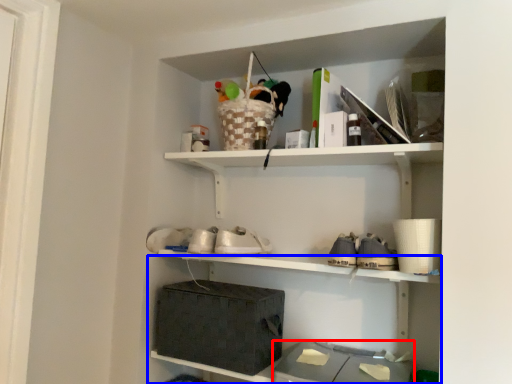
Question: Which of the following is the farthest to the observer, storage box (highlighted by a red box) or shelf (highlighted by a blue box)?

Choices:
 (A) storage box
 (B) shelf

Answer: (B)